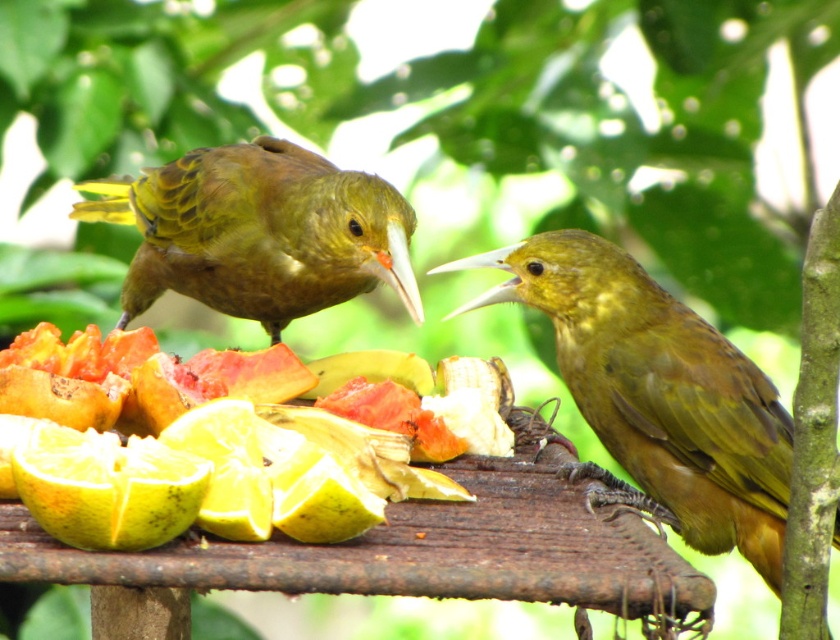
Is point (80, 400) positioned in front of point (378, 188)?

That is True.

What do you see at coordinates (224, 438) in the screenshot?
I see `juicy orange slices at lower left` at bounding box center [224, 438].

Image resolution: width=840 pixels, height=640 pixels. What do you see at coordinates (224, 438) in the screenshot?
I see `juicy orange slices at lower left` at bounding box center [224, 438].

The height and width of the screenshot is (640, 840). I want to click on juicy orange slices at lower left, so click(x=224, y=438).

Does green matte bird at right appear on the right side of ripe yellow orange at lower left?

Correct, you'll find green matte bird at right to the right of ripe yellow orange at lower left.

What do you see at coordinates (655, 396) in the screenshot?
I see `green matte bird at right` at bounding box center [655, 396].

This screenshot has width=840, height=640. Describe the element at coordinates (655, 396) in the screenshot. I see `green matte bird at right` at that location.

I want to click on green matte bird at right, so click(655, 396).

Is juicy orange slices at lower left to the right of ripe yellow orange at lower left from the viewer's perspective?

Correct, you'll find juicy orange slices at lower left to the right of ripe yellow orange at lower left.

Based on the photo, is juicy orange slices at lower left bigger than ripe yellow orange at lower left?

Yes, juicy orange slices at lower left is bigger than ripe yellow orange at lower left.

What do you see at coordinates (224, 438) in the screenshot?
I see `juicy orange slices at lower left` at bounding box center [224, 438].

The width and height of the screenshot is (840, 640). In order to click on juicy orange slices at lower left in this screenshot , I will do `click(224, 438)`.